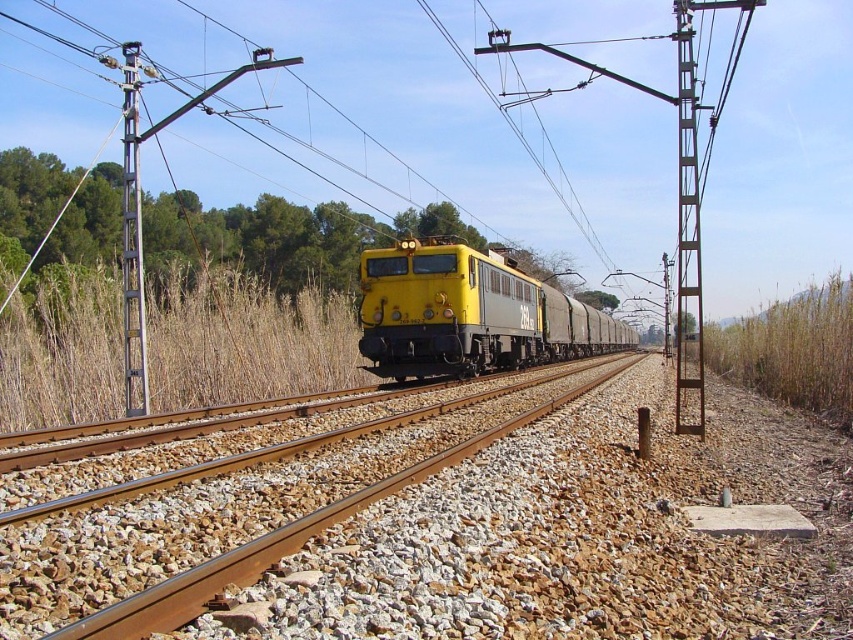
Question: Estimate the real-world distances between objects in this image. Which object is farther from the yellow matte train at center?

Choices:
 (A) green leafy tree at left
 (B) brown gravel track at center

Answer: (A)

Question: Which object is the closest to the brown metallic pole at right?

Choices:
 (A) brown gravel track at center
 (B) yellow matte train at center

Answer: (B)

Question: Does yellow matte train at center appear on the left side of brown metallic pole at right?

Choices:
 (A) yes
 (B) no

Answer: (A)

Question: Which of the following is the closest to the observer?

Choices:
 (A) (247, 230)
 (B) (508, 468)

Answer: (B)

Question: Is yellow matte train at center below brown metallic pole at right?

Choices:
 (A) yes
 (B) no

Answer: (A)

Question: Is brown gravel track at center thinner than green leafy tree at left?

Choices:
 (A) no
 (B) yes

Answer: (B)